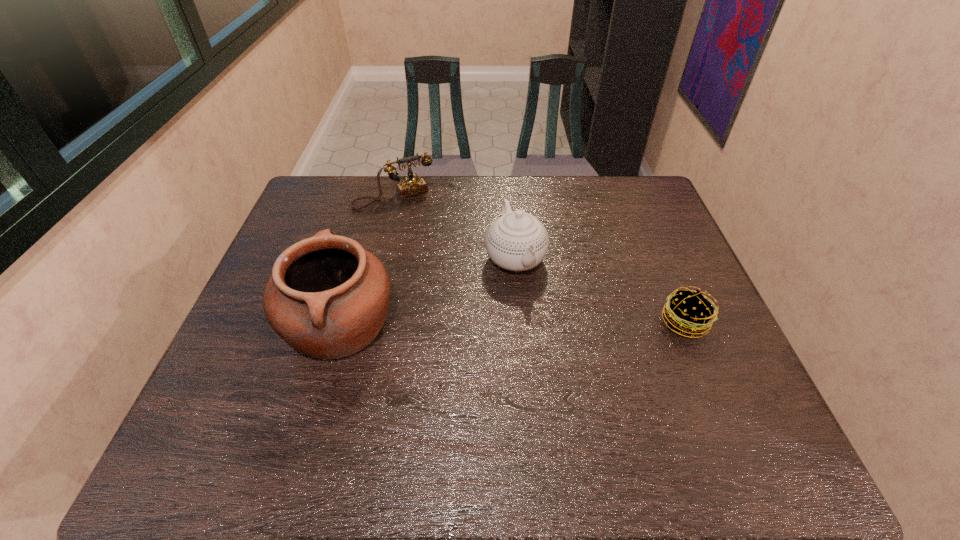
Locate an element on the screen. The image size is (960, 540). vacant area situated on the front-facing side of the third tallest object is located at coordinates (445, 275).

At what (x,y) coordinates should I click in order to perform the action: click on vacant point located on the front-facing side of the third tallest object. Please return your answer as a coordinate pair (x, y). Looking at the image, I should click on (421, 233).

This screenshot has width=960, height=540. In order to click on vacant space located on the spout of the third object from left to right in this screenshot , I will do `click(536, 305)`.

Identify the location of free space located 0.240m on the spout of the third object from left to right. (562, 359).

The width and height of the screenshot is (960, 540). In order to click on vacant space located on the spout of the third object from left to right in this screenshot , I will do `click(546, 326)`.

The width and height of the screenshot is (960, 540). What are the coordinates of `object that is at the far edge` in the screenshot? It's located at (412, 185).

The height and width of the screenshot is (540, 960). I want to click on object that is positioned at the left edge, so click(x=327, y=297).

The image size is (960, 540). What are the coordinates of `object present at the right edge` in the screenshot? It's located at (689, 312).

Image resolution: width=960 pixels, height=540 pixels. Find the location of `vacant space at the far edge of the desktop`. vacant space at the far edge of the desktop is located at coordinates (507, 184).

The width and height of the screenshot is (960, 540). I want to click on free space at the near edge of the desktop, so [485, 404].